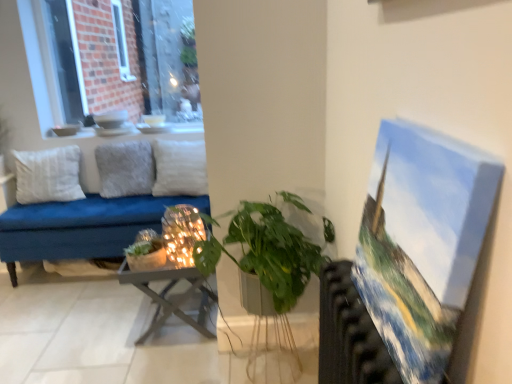
Question: Is the position of iridescent glass candle holder at center less distant than that of green matte plant at center, the first houseplant in the left-to-right sequence?

Choices:
 (A) no
 (B) yes

Answer: (B)

Question: From a real-world perspective, is iridescent glass candle holder at center below green matte plant at center, the first houseplant in the left-to-right sequence?

Choices:
 (A) yes
 (B) no

Answer: (B)

Question: Does iridescent glass candle holder at center contain green matte plant at center, the first houseplant in the left-to-right sequence?

Choices:
 (A) no
 (B) yes

Answer: (A)

Question: Does iridescent glass candle holder at center have a greater height compared to green matte plant at center, marked as the second houseplant in a right-to-left arrangement?

Choices:
 (A) yes
 (B) no

Answer: (A)

Question: Does iridescent glass candle holder at center appear on the right side of green matte plant at center, which is counted as the second houseplant, starting from the front?

Choices:
 (A) yes
 (B) no

Answer: (A)

Question: Does iridescent glass candle holder at center appear on the left side of green matte plant at center, marked as the second houseplant in a right-to-left arrangement?

Choices:
 (A) yes
 (B) no

Answer: (B)

Question: Considering the relative positions of iridescent glass candle holder at center and white soft pillow at center, the third pillow viewed from the left, in the image provided, is iridescent glass candle holder at center behind white soft pillow at center, the third pillow viewed from the left,?

Choices:
 (A) no
 (B) yes

Answer: (A)

Question: Is white soft pillow at center, positioned as the first pillow in right-to-left order, inside iridescent glass candle holder at center?

Choices:
 (A) yes
 (B) no

Answer: (B)

Question: Does iridescent glass candle holder at center have a lesser height compared to white soft pillow at center, the third pillow viewed from the left?

Choices:
 (A) no
 (B) yes

Answer: (B)

Question: Is the surface of iridescent glass candle holder at center in direct contact with white soft pillow at center, positioned as the first pillow in right-to-left order?

Choices:
 (A) no
 (B) yes

Answer: (A)

Question: Is iridescent glass candle holder at center positioned with its back to white soft pillow at center, positioned as the first pillow in right-to-left order?

Choices:
 (A) yes
 (B) no

Answer: (B)

Question: Can you confirm if iridescent glass candle holder at center is thinner than white soft pillow at center, the third pillow viewed from the left?

Choices:
 (A) no
 (B) yes

Answer: (B)

Question: From the image's perspective, is brick wall at upper left under oil paint canvas at right?

Choices:
 (A) no
 (B) yes

Answer: (A)